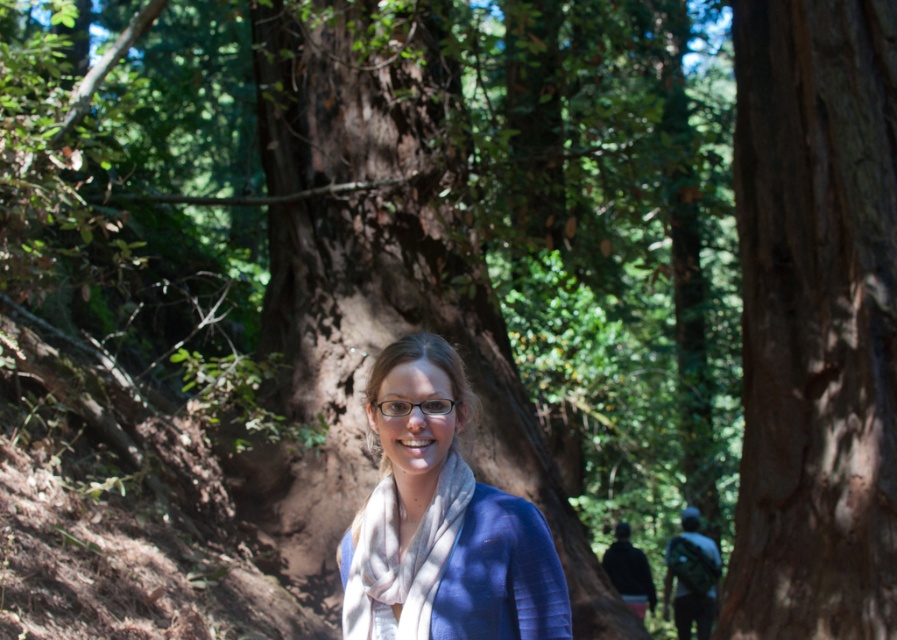
You are a photographer positioned at point 0.000, 0.000 in the forest scene. You want to take a photo of the brown rough bark tree at center. What are the coordinates of the tree to frame it properly?

The coordinates of the brown rough bark tree at center are at point (815, 320).

You are a photographer trying to capture the woman in the forest scene. You notice two scarves on her, the blue matte scarf at center and the white soft scarf at center. Which scarf is located to the right when viewed from the front?

The blue matte scarf at center is positioned on the right side of the white soft scarf at center, so it is located to the right when viewed from the front.

You are the photographer who took this picture of the woman in the forest. You want to adjust your camera to focus on the blue matte scarf at center without losing focus on the brown rough bark tree at center. Is this possible given their positions?

The brown rough bark tree at center is located above the blue matte scarf at center, so adjusting the camera focus to include both might be challenging since they are at different vertical levels. However, if the depth of field is sufficient, it could be possible to keep both in focus.